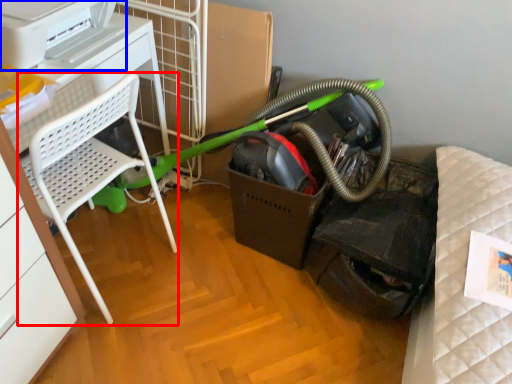
Question: Which point is further to the camera, furniture (highlighted by a red box) or printer (highlighted by a blue box)?

Choices:
 (A) furniture
 (B) printer

Answer: (B)